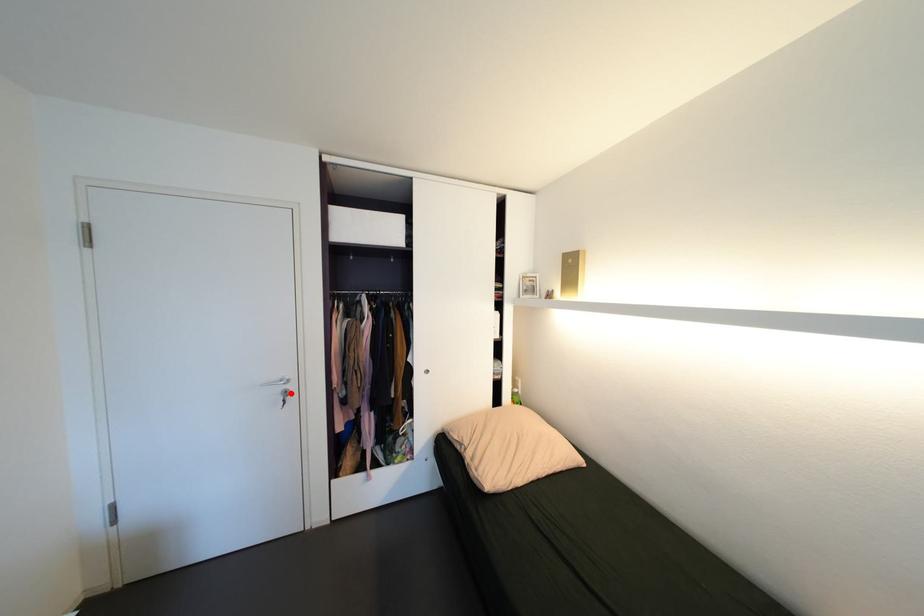
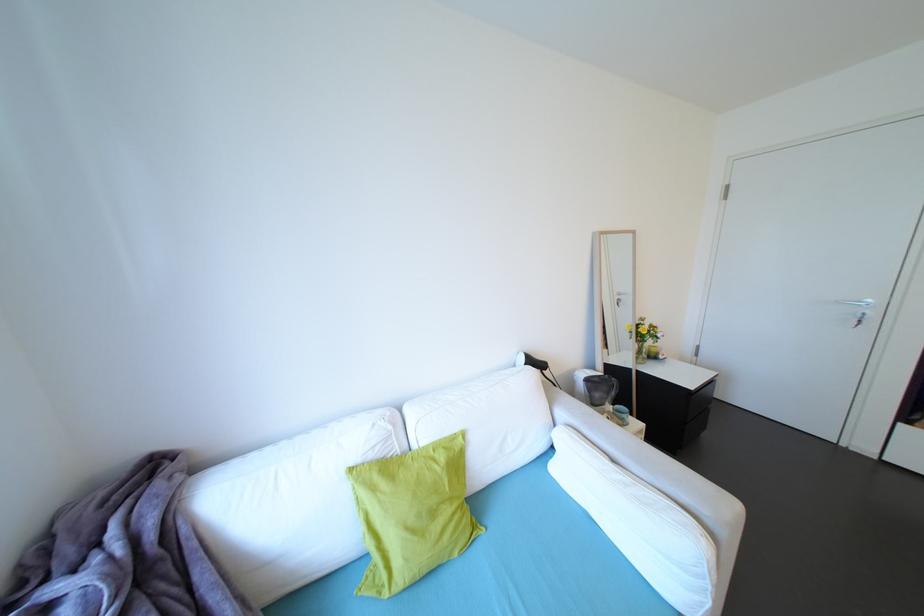
In the second image, find the point that corresponds to the highlighted location in the first image.

(868, 315)